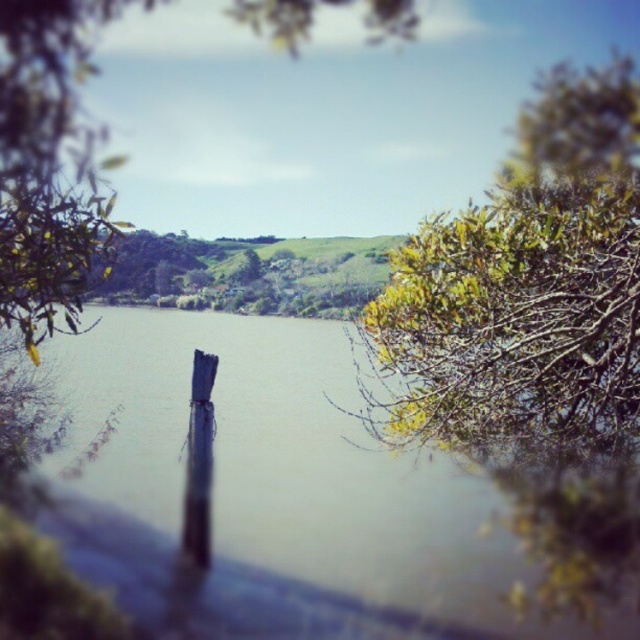
Question: Which of the following is the farthest from the observer?

Choices:
 (A) 460,326
 (B) 545,157
 (C) 67,244

Answer: (B)

Question: Is brown wood post at center to the left of green leafy tree at upper right from the viewer's perspective?

Choices:
 (A) no
 (B) yes

Answer: (B)

Question: Is green leafy tree at center further to the viewer compared to green leafy tree at upper right?

Choices:
 (A) no
 (B) yes

Answer: (A)

Question: Can you confirm if green leafy branches at upper right is positioned to the left of green leafy tree at upper right?

Choices:
 (A) yes
 (B) no

Answer: (A)

Question: Which point is farther to the camera?

Choices:
 (A) (568, 108)
 (B) (298, 525)
 (C) (609, 118)

Answer: (A)

Question: Which point is farther from the camera taking this photo?

Choices:
 (A) 260,436
 (B) 461,448
 (C) 64,232
 (D) 621,132

Answer: (A)